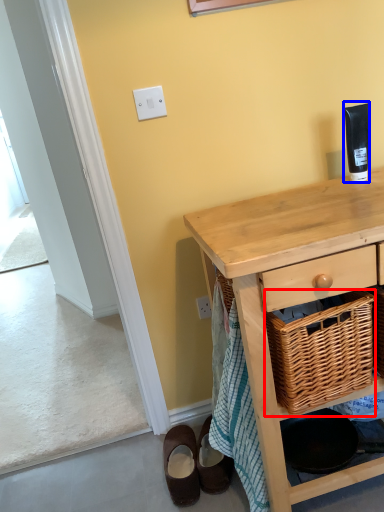
Question: Which point is further to the camera, picnic basket (highlighted by a red box) or toiletry (highlighted by a blue box)?

Choices:
 (A) picnic basket
 (B) toiletry

Answer: (B)